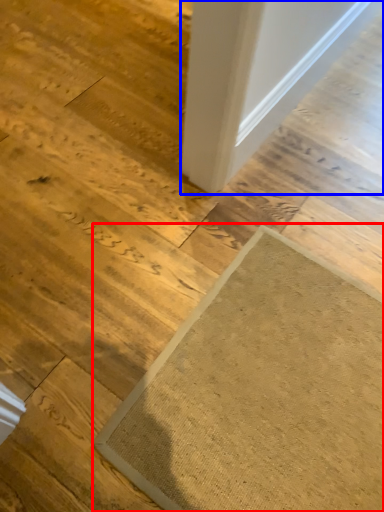
Question: Which of the following is the farthest to the observer, mat (highlighted by a red box) or door (highlighted by a blue box)?

Choices:
 (A) mat
 (B) door

Answer: (B)